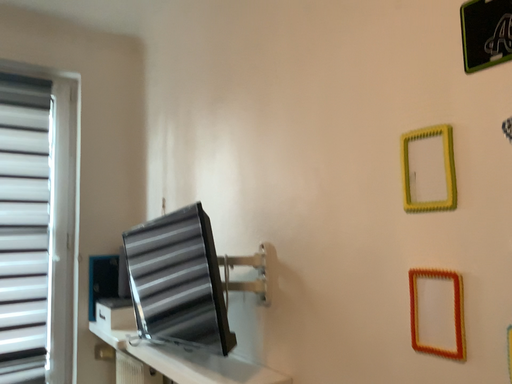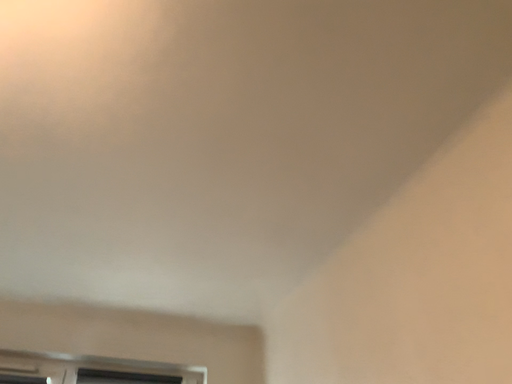
Question: How did the camera likely rotate when shooting the video?

Choices:
 (A) rotated downward
 (B) rotated upward

Answer: (B)